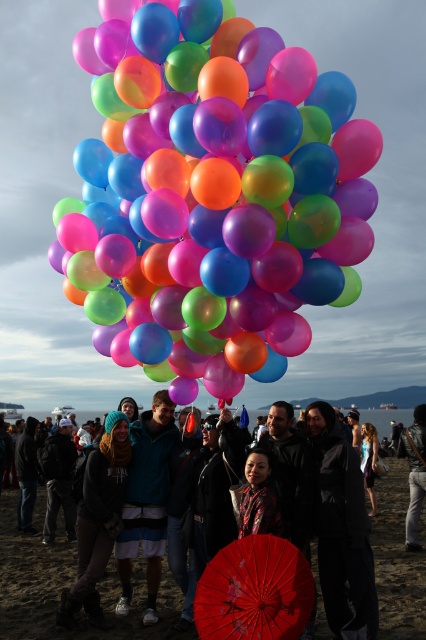
Can you confirm if translucent glossy balloons at center is thinner than red paper umbrella at center?

Yes.

Is point (354, 140) closer to camera compared to point (57, 552)?

Yes, point (354, 140) is closer to viewer.

Describe the element at coordinates (224, 176) in the screenshot. This screenshot has width=426, height=640. I see `translucent glossy balloons at center` at that location.

I want to click on translucent glossy balloons at center, so click(224, 176).

Is red paper umbrella at center bigger than denim jacket at lower right?

Yes.

Describe the element at coordinates (66, 586) in the screenshot. The width and height of the screenshot is (426, 640). I see `red paper umbrella at center` at that location.

Locate an element on the screen. red paper umbrella at center is located at coordinates (66, 586).

Can you confirm if red glossy umbrella at center is positioned below matte black hoodie at center?

Actually, red glossy umbrella at center is above matte black hoodie at center.

Which is below, red glossy umbrella at center or matte black hoodie at center?

Positioned lower is matte black hoodie at center.

Find the location of a particular element. red glossy umbrella at center is located at coordinates (253, 589).